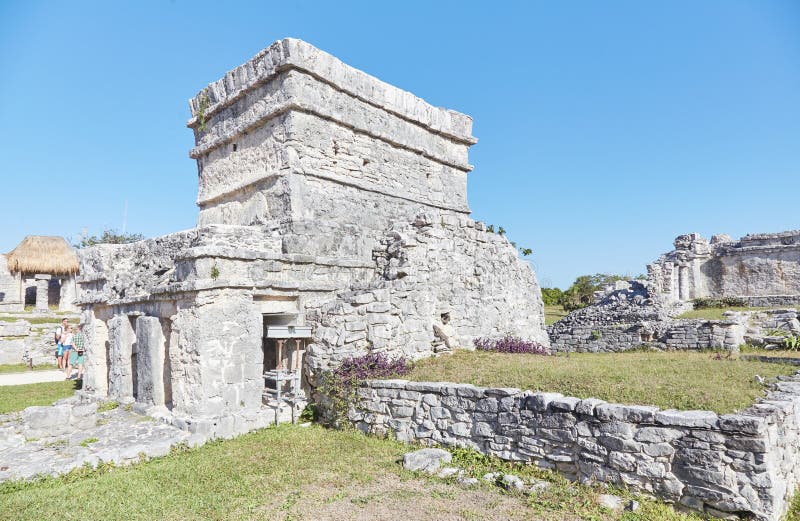
This screenshot has height=521, width=800. I want to click on wall, so click(x=349, y=233).